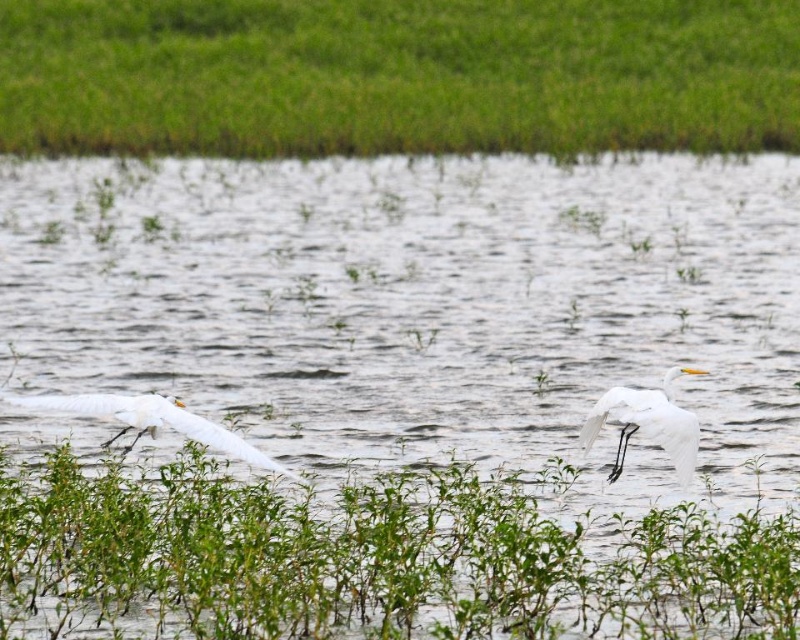
You are a photographer taking a picture of the green grass at upper center and the white feathered bird at left. Which object is closer to your camera lens?

The green grass at upper center is closer to the camera lens than the white feathered bird at left.